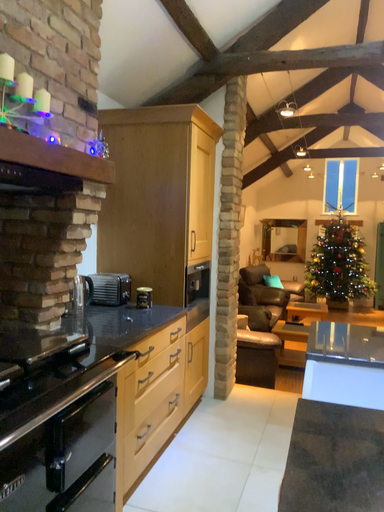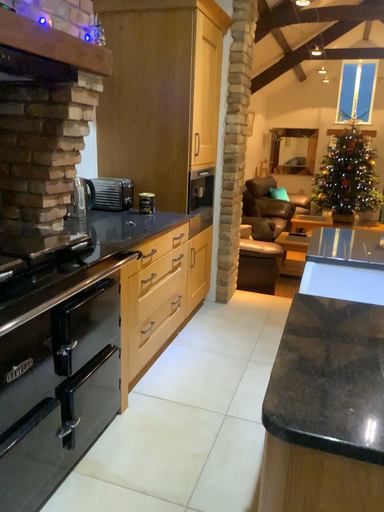
Question: Which way did the camera rotate in the video?

Choices:
 (A) rotated downward
 (B) rotated upward

Answer: (A)